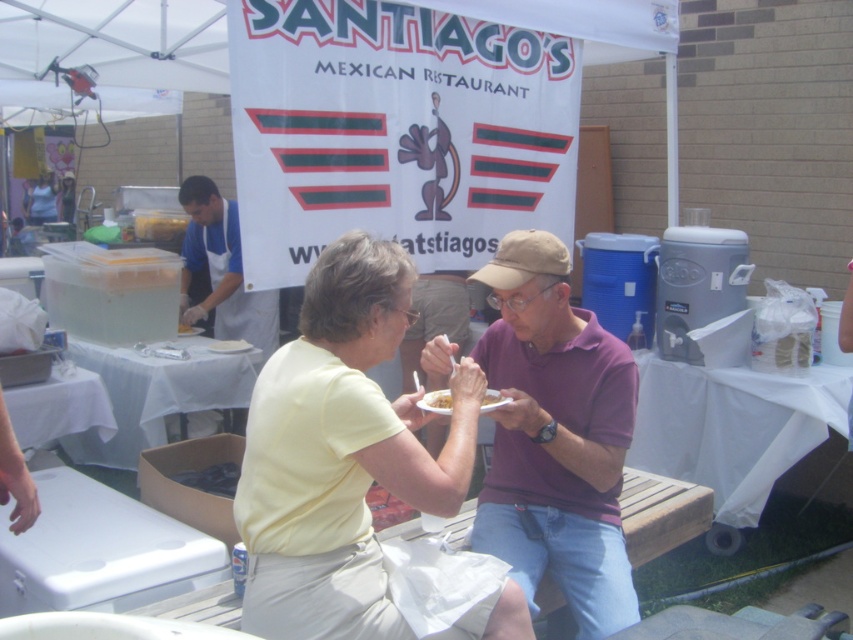
Is purple cotton shirt at center bigger than yellow matte plate at center?

Yes.

Can you confirm if purple cotton shirt at center is positioned below yellow matte plate at center?

Yes, purple cotton shirt at center is below yellow matte plate at center.

Does point (595, 467) lie in front of point (496, 401)?

Yes, point (595, 467) is in front of point (496, 401).

Locate an element on the screen. The width and height of the screenshot is (853, 640). purple cotton shirt at center is located at coordinates (555, 436).

Is white apron at left positioned behind yellow matte plate at center?

Yes, it is behind yellow matte plate at center.

What do you see at coordinates (221, 269) in the screenshot? I see `white apron at left` at bounding box center [221, 269].

Where is `white apron at left`? This screenshot has width=853, height=640. white apron at left is located at coordinates (221, 269).

Does point (260, 408) come farther from viewer compared to point (589, 596)?

No, (260, 408) is closer to viewer.

Is yellow fabric shirt at center taller than purple cotton shirt at center?

No.

Is point (351, 529) positioned behind point (497, 484)?

No, it is in front of (497, 484).

You are a GUI agent. You are given a task and a screenshot of the screen. Output one action in this format:
    pyautogui.click(x=<x>, y=<y>)
    Task: Click on the yellow fabric shirt at center
    Image resolution: width=853 pixels, height=640 pixels.
    Given the screenshot: What is the action you would take?
    pyautogui.click(x=341, y=452)